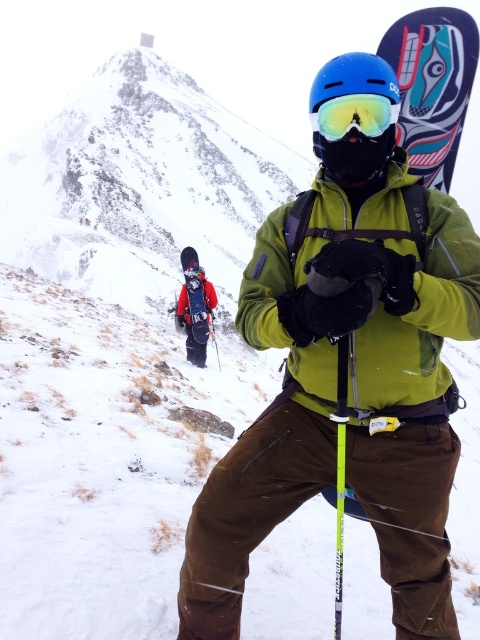
Question: Estimate the real-world distances between objects in this image. Which object is farther from the green matte jacket at center?

Choices:
 (A) matte black snowboard at center
 (B) green reflective lens goggles at center

Answer: (A)

Question: Is green reflective lens goggles at center above matte black snowboard at center?

Choices:
 (A) no
 (B) yes

Answer: (B)

Question: Does green matte jacket at center have a larger size compared to matte black snowboard at center?

Choices:
 (A) yes
 (B) no

Answer: (A)

Question: Does green matte jacket at center have a smaller size compared to dark blue painted wood snowboard at center?

Choices:
 (A) yes
 (B) no

Answer: (B)

Question: Which object is farther from the camera taking this photo?

Choices:
 (A) dark blue painted wood snowboard at center
 (B) green reflective lens goggles at center
 (C) matte black snowboard at center
 (D) green matte jacket at center

Answer: (C)

Question: Among these objects, which one is farthest from the camera?

Choices:
 (A) matte black snowboard at center
 (B) green reflective lens goggles at center

Answer: (A)